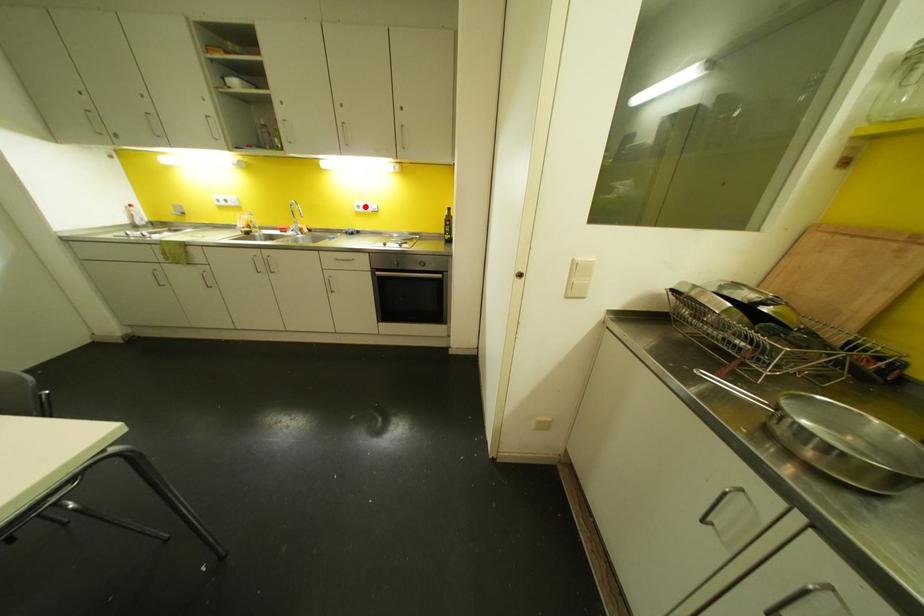
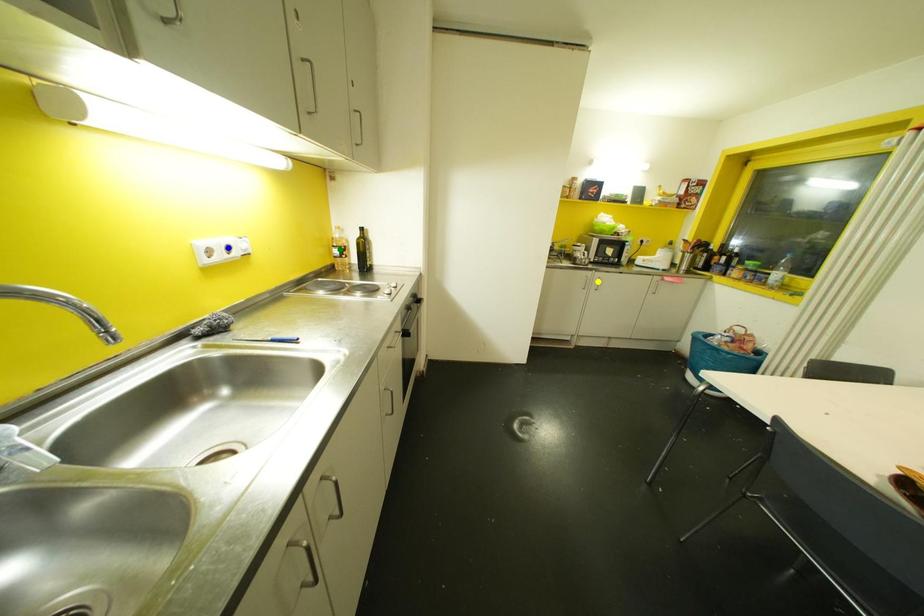
Question: I am providing you with two images of the same scene from different viewpoints. A red point is marked on the first image. You are given multiple points on the second image. Which mark in image 2 goes with the point in image 1?

Choices:
 (A) green point
 (B) blue point
 (C) yellow point

Answer: (B)